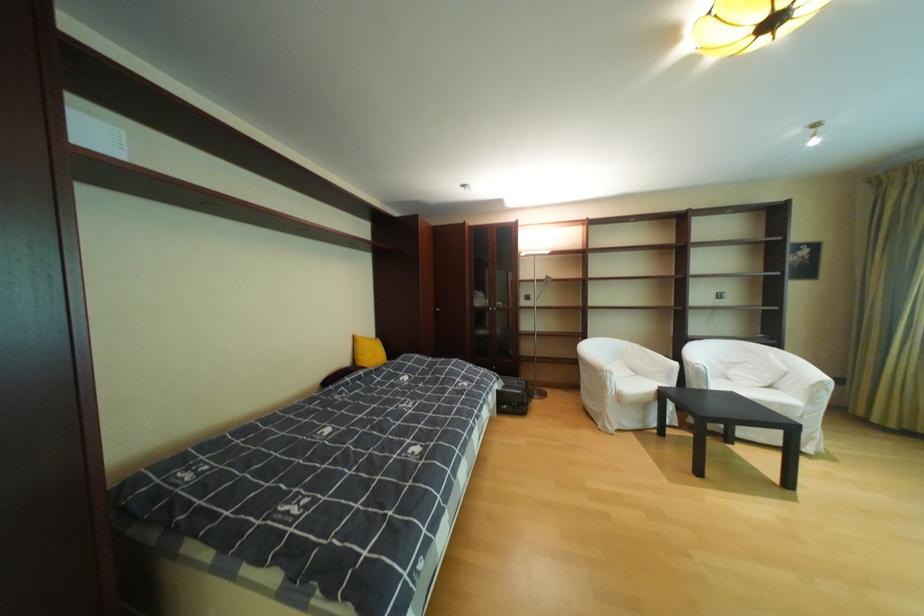
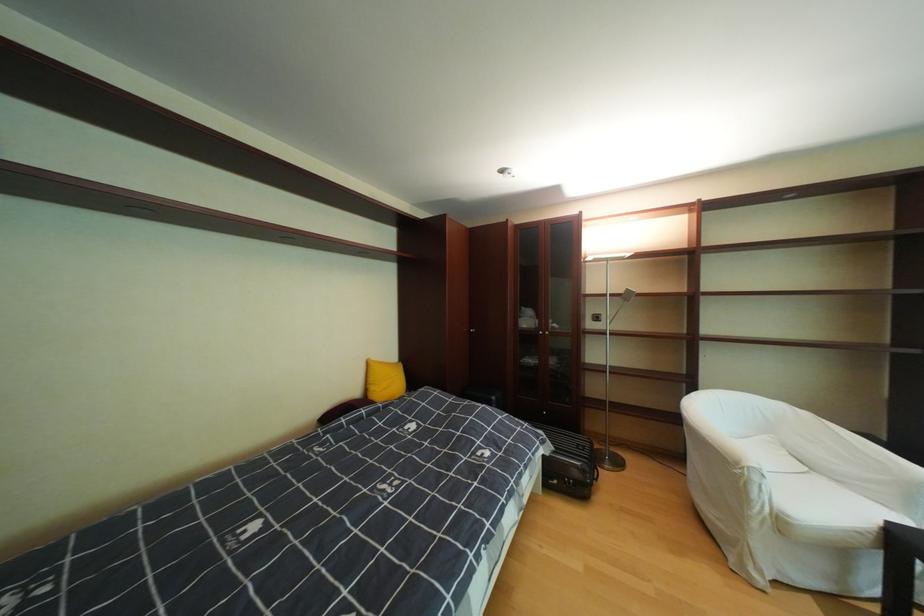
Locate, in the second image, the point that corresponds to point 603,339 in the first image.

(719, 389)